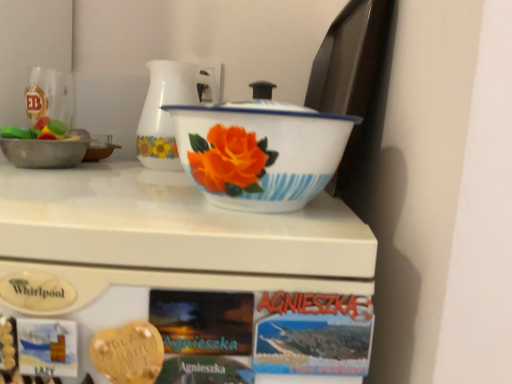
Question: Should I look upward or downward to see white glossy refrigerator at upper center?

Choices:
 (A) up
 (B) down

Answer: (B)

Question: Is golden heart-shaped cookie at center far away from white glossy refrigerator at upper center?

Choices:
 (A) yes
 (B) no

Answer: (B)

Question: From a real-world perspective, is golden heart-shaped cookie at center located beneath white glossy refrigerator at upper center?

Choices:
 (A) yes
 (B) no

Answer: (B)

Question: Is golden heart-shaped cookie at center placed right next to white glossy refrigerator at upper center?

Choices:
 (A) yes
 (B) no

Answer: (B)

Question: Can we say golden heart-shaped cookie at center lies outside white glossy refrigerator at upper center?

Choices:
 (A) yes
 (B) no

Answer: (B)

Question: Is golden heart-shaped cookie at center at the left side of white glossy refrigerator at upper center?

Choices:
 (A) yes
 (B) no

Answer: (B)

Question: From the image's perspective, does golden heart-shaped cookie at center appear higher than white glossy refrigerator at upper center?

Choices:
 (A) yes
 (B) no

Answer: (A)

Question: Is white glossy jug at center thinner than white glossy refrigerator at upper center?

Choices:
 (A) no
 (B) yes

Answer: (B)

Question: Is white glossy refrigerator at upper center at the back of white glossy jug at center?

Choices:
 (A) yes
 (B) no

Answer: (B)

Question: Can you confirm if white glossy jug at center is positioned to the left of white glossy refrigerator at upper center?

Choices:
 (A) no
 (B) yes

Answer: (A)

Question: Is white glossy jug at center aimed at white glossy refrigerator at upper center?

Choices:
 (A) yes
 (B) no

Answer: (B)

Question: Does white glossy jug at center lie in front of white glossy refrigerator at upper center?

Choices:
 (A) yes
 (B) no

Answer: (B)

Question: Is white glossy jug at center taller than white glossy refrigerator at upper center?

Choices:
 (A) yes
 (B) no

Answer: (B)

Question: Is white enamel basin at center behind white glossy refrigerator at upper center?

Choices:
 (A) no
 (B) yes

Answer: (B)